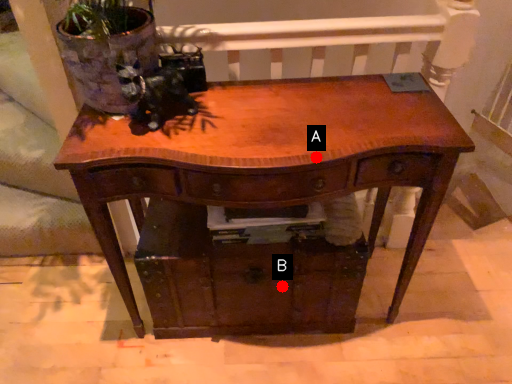
Question: Two points are circled on the image, labeled by A and B beside each circle. Which point is farther from the camera taking this photo?

Choices:
 (A) A is further
 (B) B is further

Answer: (B)